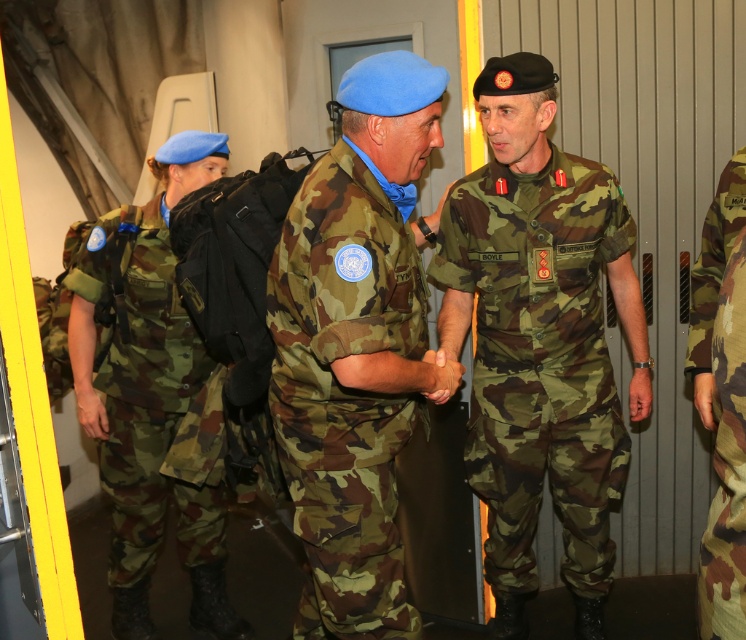
Question: Can you confirm if camo fabric uniform at center is smaller than camouflage fabric uniform at right?

Choices:
 (A) yes
 (B) no

Answer: (B)

Question: Which of the following is the farthest from the observer?

Choices:
 (A) (724, 614)
 (B) (533, 237)

Answer: (B)

Question: Can you confirm if camouflage fabric uniform at center is smaller than camo fabric uniform at center?

Choices:
 (A) yes
 (B) no

Answer: (B)

Question: Which object is the farthest from the camouflage fabric uniform at center?

Choices:
 (A) camouflage fabric uniform at right
 (B) camo fabric uniform at left

Answer: (A)

Question: Which of the following is the farthest from the observer?

Choices:
 (A) camouflage fabric uniform at center
 (B) camo fabric uniform at left
 (C) camo fabric uniform at center

Answer: (B)

Question: Does camo fabric uniform at center have a lesser width compared to camo fabric uniform at left?

Choices:
 (A) yes
 (B) no

Answer: (A)